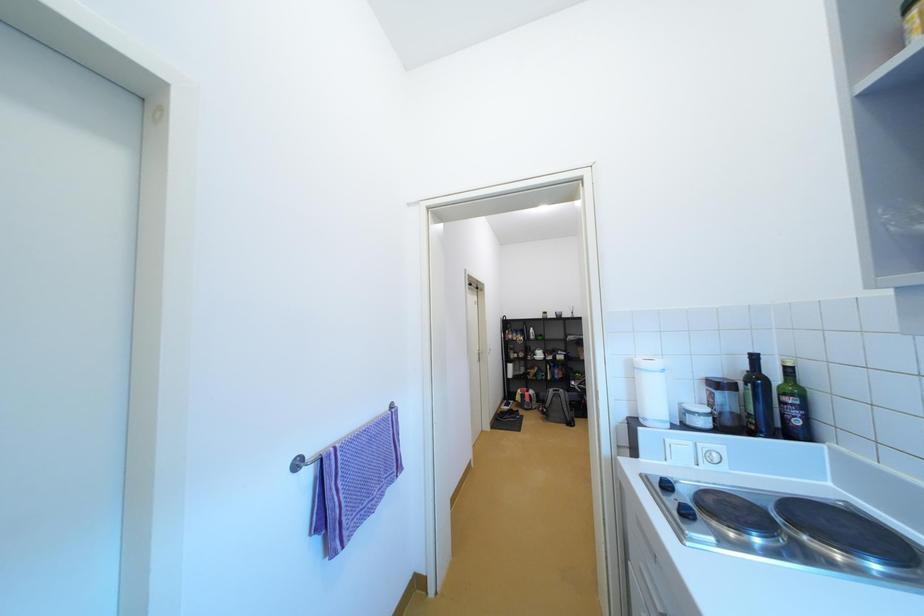
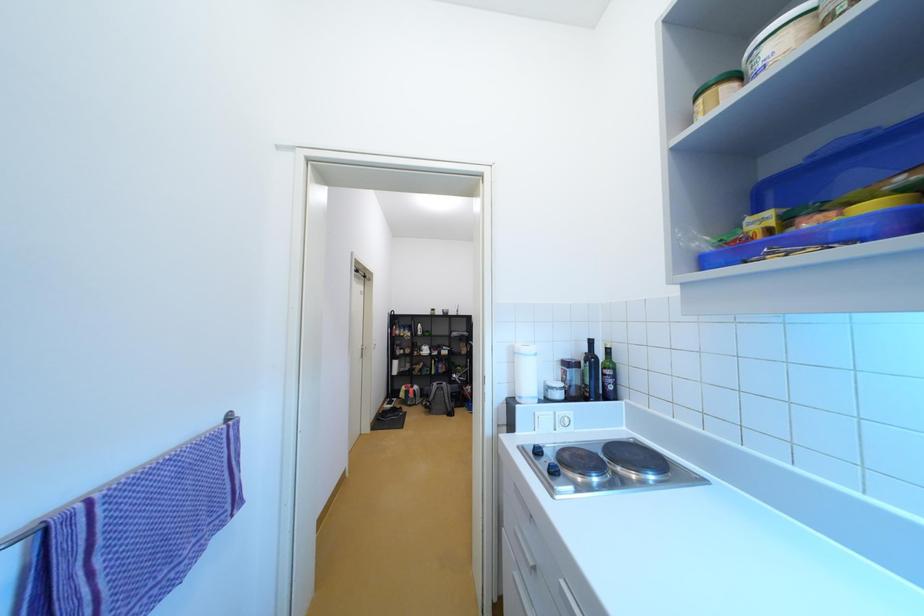
Question: In a continuous first-person perspective shot, in which direction is the camera moving?

Choices:
 (A) Left
 (B) Right
 (C) Forward
 (D) Backward

Answer: (C)